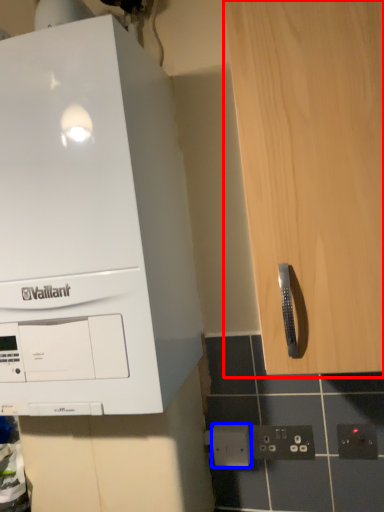
Question: Among these objects, which one is farthest to the camera, cabinetry (highlighted by a red box) or electric outlet (highlighted by a blue box)?

Choices:
 (A) cabinetry
 (B) electric outlet

Answer: (B)